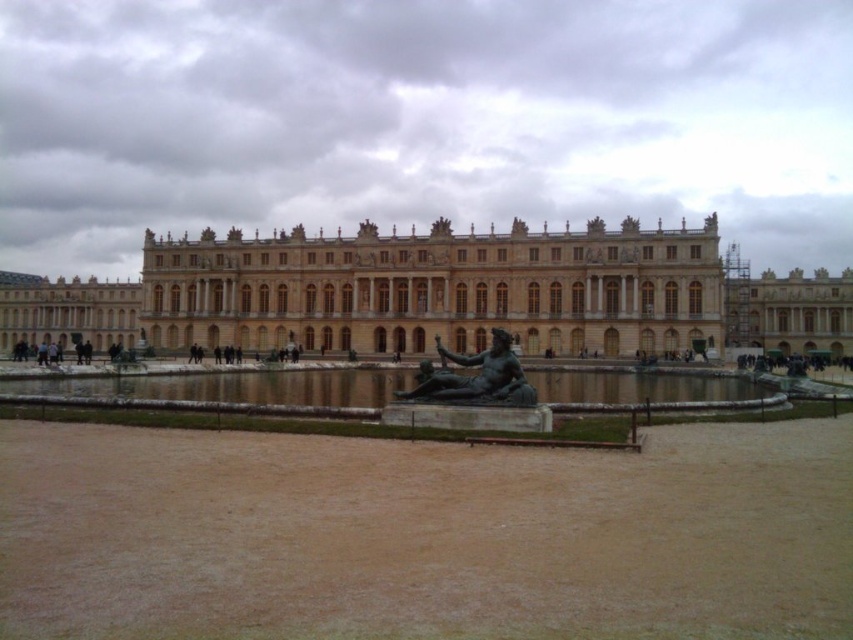
From the picture: You are a tour guide explaining the historical building to a group. You mention the bronze statue at center and the dark brown leather person at lower left. Which one is taller?

The bronze statue at center is much taller than the dark brown leather person at lower left.